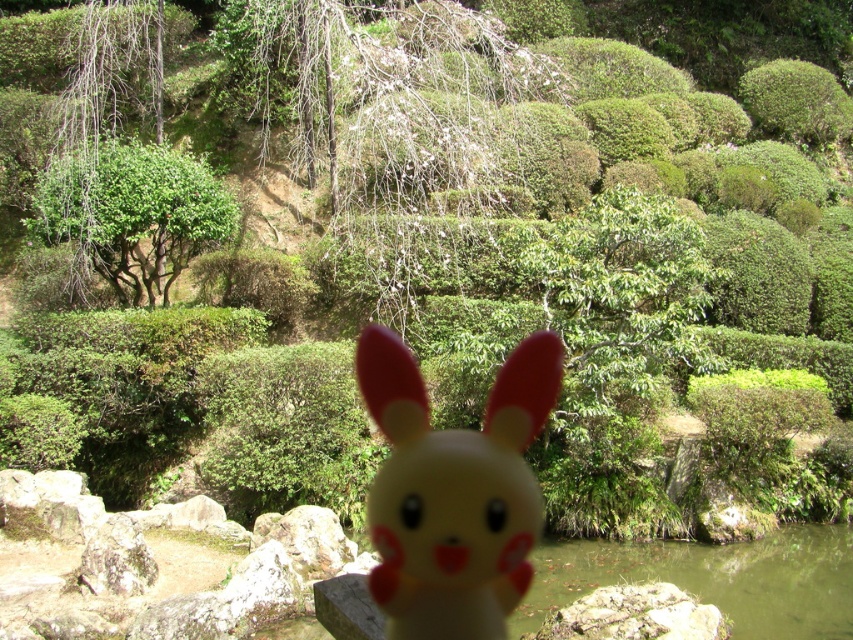
Where is the yellow matte plastic bunny at center located in the garden scene?

The yellow matte plastic bunny at center is located at point (454, 492) in the garden scene.

A child wants to throw a ball from the yellow matte plastic bunny at center to the green leafy tree at left. The ball can travel 25 feet. Will the ball reach the tree?

The yellow matte plastic bunny at center is 26.58 feet away from the green leafy tree at left. Since the ball can only travel 25 feet, it won not reach the tree.